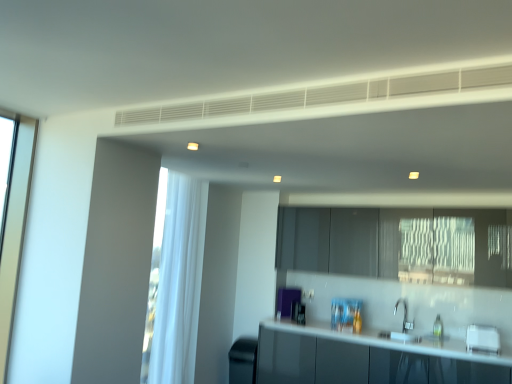
Question: In the image, is glossy white countertop at lower center on the left side or the right side of white matte exhaust hood at upper center?

Choices:
 (A) right
 (B) left

Answer: (A)

Question: Is glossy white countertop at lower center taller or shorter than white matte exhaust hood at upper center?

Choices:
 (A) tall
 (B) short

Answer: (A)

Question: Which object is positioned closest to the white matte exhaust hood at upper center?

Choices:
 (A) glossy white countertop at lower center
 (B) white glossy toaster at lower right, the first appliance in the front-to-back sequence
 (C) matte gray cabinetry at center
 (D) white sheer curtain at left
 (E) black matte trash can at lower left, placed as the 1th appliance when sorted from left to right

Answer: (D)

Question: Which of these objects is positioned farthest from the matte gray cabinetry at center?

Choices:
 (A) white matte exhaust hood at upper center
 (B) white glossy toaster at lower right, the 1th appliance from the top
 (C) glossy white countertop at lower center
 (D) white sheer curtain at left
 (E) black matte trash can at lower left, placed as the 2th appliance when sorted from top to bottom

Answer: (A)